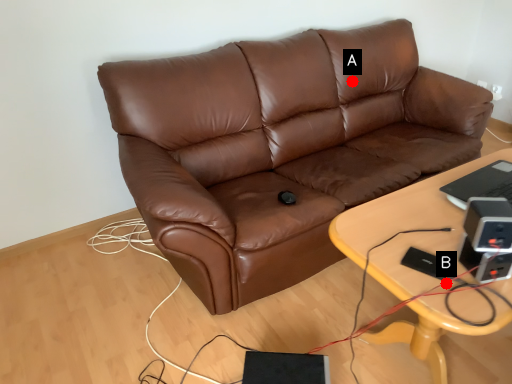
Question: Two points are circled on the image, labeled by A and B beside each circle. Which point appears closest to the camera in this image?

Choices:
 (A) A is closer
 (B) B is closer

Answer: (B)